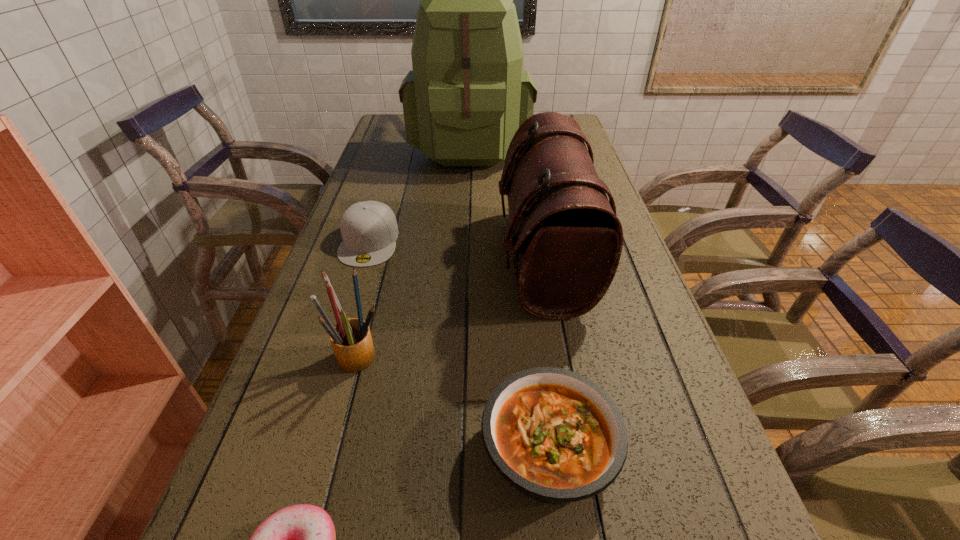
Where is `vacant space located 0.090m on the front-facing side of the fifth shortest object`? The image size is (960, 540). vacant space located 0.090m on the front-facing side of the fifth shortest object is located at coordinates (463, 259).

The height and width of the screenshot is (540, 960). I want to click on vacant space located on the back of the fourth farthest object, so click(393, 232).

Where is `free location located on the front-facing side of the cap`? This screenshot has height=540, width=960. free location located on the front-facing side of the cap is located at coordinates (325, 381).

This screenshot has width=960, height=540. Identify the location of free space located 0.230m on the back of the stew. (531, 304).

Where is `object that is at the far edge`? object that is at the far edge is located at coordinates (467, 95).

The height and width of the screenshot is (540, 960). Identify the location of backpack that is at the left edge. (467, 95).

The height and width of the screenshot is (540, 960). I want to click on pencil box that is positioned at the left edge, so click(351, 340).

Find the location of a particular element. The height and width of the screenshot is (540, 960). cap situated at the left edge is located at coordinates (369, 229).

Identify the location of satchel present at the right edge. The height and width of the screenshot is (540, 960). (562, 229).

Identify the location of stew situated at the right edge. The height and width of the screenshot is (540, 960). (558, 437).